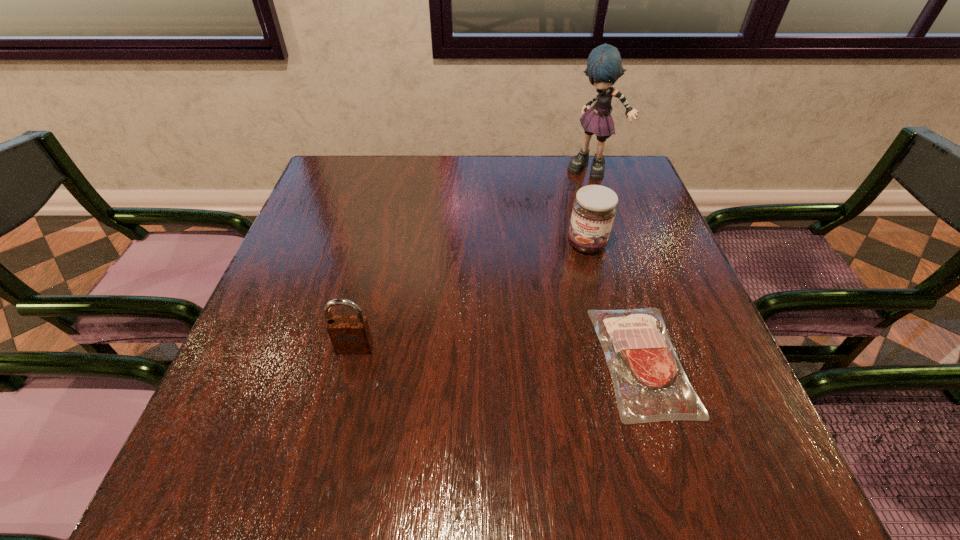
In the image, there is a desktop. At what (x,y) coordinates should I click in order to perform the action: click on vacant region at the far edge. Please return your answer as a coordinate pair (x, y). Looking at the image, I should click on (554, 193).

The width and height of the screenshot is (960, 540). Identify the location of blank area at the near edge. (567, 385).

You are a GUI agent. You are given a task and a screenshot of the screen. Output one action in this format:
    pyautogui.click(x=<x>, y=<y>)
    Task: Click on the vacant space at the left edge of the desktop
    Image resolution: width=960 pixels, height=540 pixels.
    Given the screenshot: What is the action you would take?
    pyautogui.click(x=350, y=227)

Find the location of a particular element. free space at the right edge is located at coordinates (614, 257).

Locate an element on the screen. The height and width of the screenshot is (540, 960). free space at the far left corner is located at coordinates (322, 199).

Find the location of a particular element. vacant space at the near left corner is located at coordinates (210, 426).

In the image, there is a desktop. At what (x,y) coordinates should I click in order to perform the action: click on vacant space at the near right corner. Please return your answer as a coordinate pair (x, y). Looking at the image, I should click on (730, 392).

Locate an element on the screen. The height and width of the screenshot is (540, 960). free space between the third nearest object and the padlock is located at coordinates (471, 296).

Locate an element on the screen. This screenshot has width=960, height=540. empty space between the shortest object and the jam is located at coordinates (614, 302).

Identify the location of empty space that is in between the leftmost object and the shortest object. (498, 354).